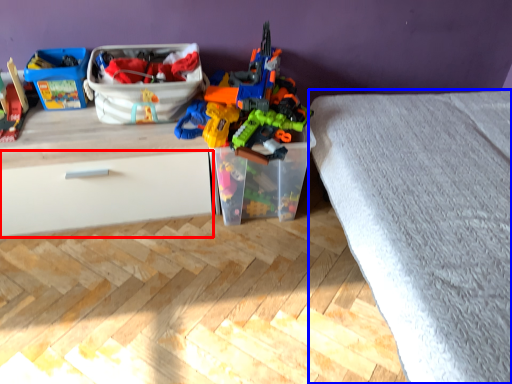
Question: Which object appears farthest to the camera in this image, drawer (highlighted by a red box) or bed frame (highlighted by a blue box)?

Choices:
 (A) drawer
 (B) bed frame

Answer: (A)